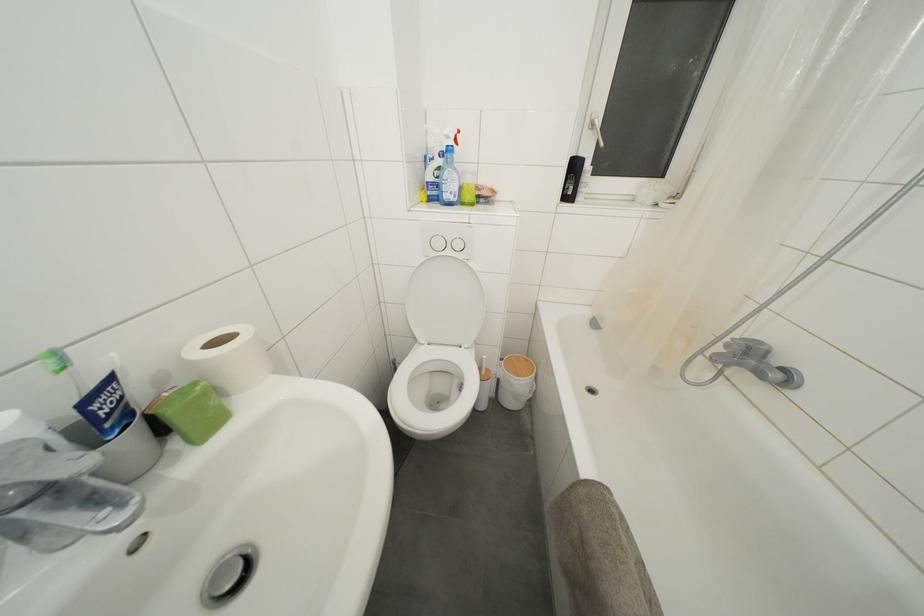
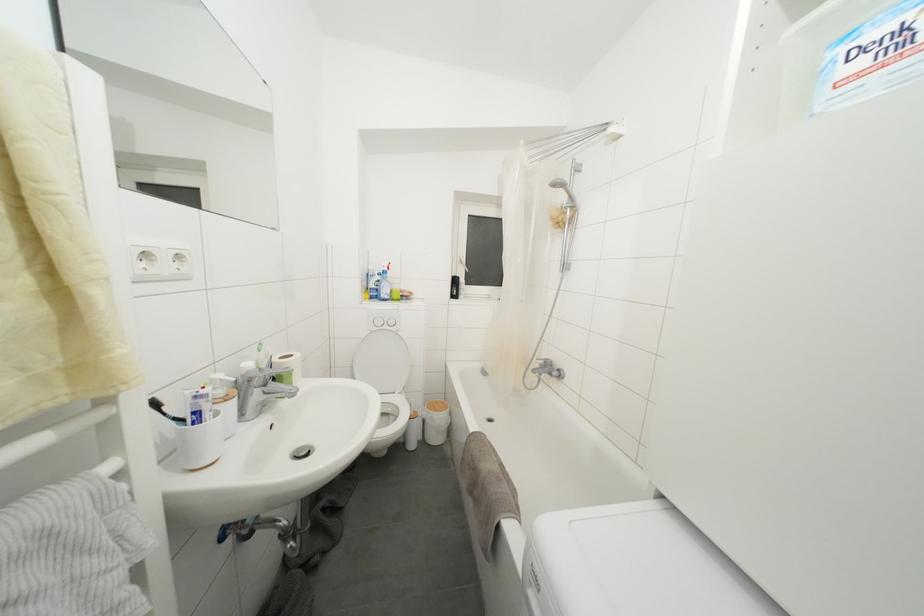
Question: In a continuous first-person perspective shot, in which direction is the camera moving?

Choices:
 (A) Left
 (B) Right
 (C) Forward
 (D) Backward

Answer: (D)